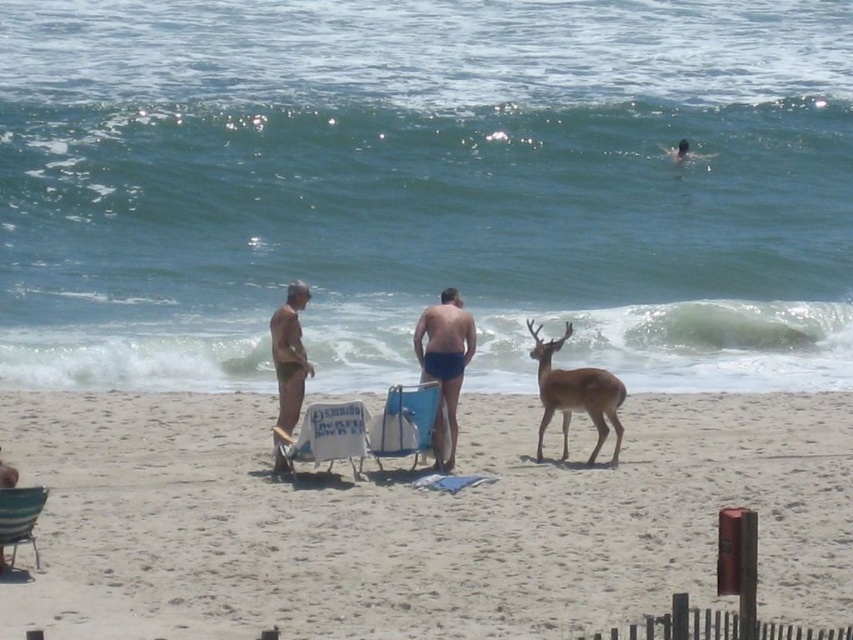
Does matte blue shorts at center appear over matte skin man at center?

Actually, matte blue shorts at center is below matte skin man at center.

Which is behind, point (416, 324) or point (279, 356)?

Point (416, 324)

What do you see at coordinates (444, 362) in the screenshot? This screenshot has width=853, height=640. I see `matte blue shorts at center` at bounding box center [444, 362].

Image resolution: width=853 pixels, height=640 pixels. Find the location of `matte blue shorts at center`. matte blue shorts at center is located at coordinates (444, 362).

Can you confirm if brown velvet deer at center is positioned above matte blue shorts at center?

Actually, brown velvet deer at center is below matte blue shorts at center.

Looking at this image, who is lower down, brown velvet deer at center or matte blue shorts at center?

brown velvet deer at center is lower down.

Is point (618, 401) closer to camera compared to point (457, 355)?

No, it is behind (457, 355).

You are a GUI agent. You are given a task and a screenshot of the screen. Output one action in this format:
    pyautogui.click(x=<x>, y=<y>)
    Task: Click on the brown velvet deer at center
    The width and height of the screenshot is (853, 640).
    Given the screenshot: What is the action you would take?
    pyautogui.click(x=575, y=394)

How far apart are blue fabric beach chair at center and matte skin man at center?

Answer: The distance of blue fabric beach chair at center from matte skin man at center is 37.99 inches.

Between blue fabric beach chair at center and matte skin man at center, which one appears on the left side from the viewer's perspective?

From the viewer's perspective, matte skin man at center appears more on the left side.

Identify the location of blue fabric beach chair at center. The image size is (853, 640). (405, 422).

You are a GUI agent. You are given a task and a screenshot of the screen. Output one action in this format:
    pyautogui.click(x=<x>, y=<y>)
    Task: Click on the blue fabric beach chair at center
    This screenshot has width=853, height=640.
    Given the screenshot: What is the action you would take?
    pyautogui.click(x=405, y=422)